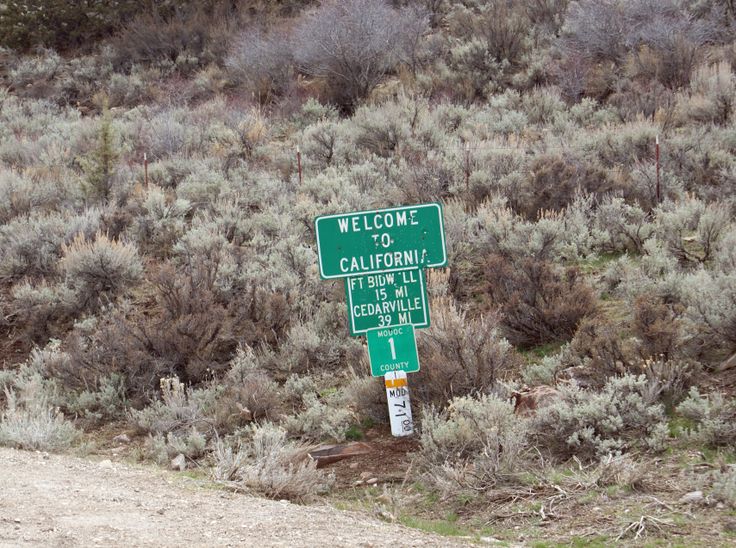
Locate an element on the screen. The image size is (736, 548). welcome sign is located at coordinates (427, 247).